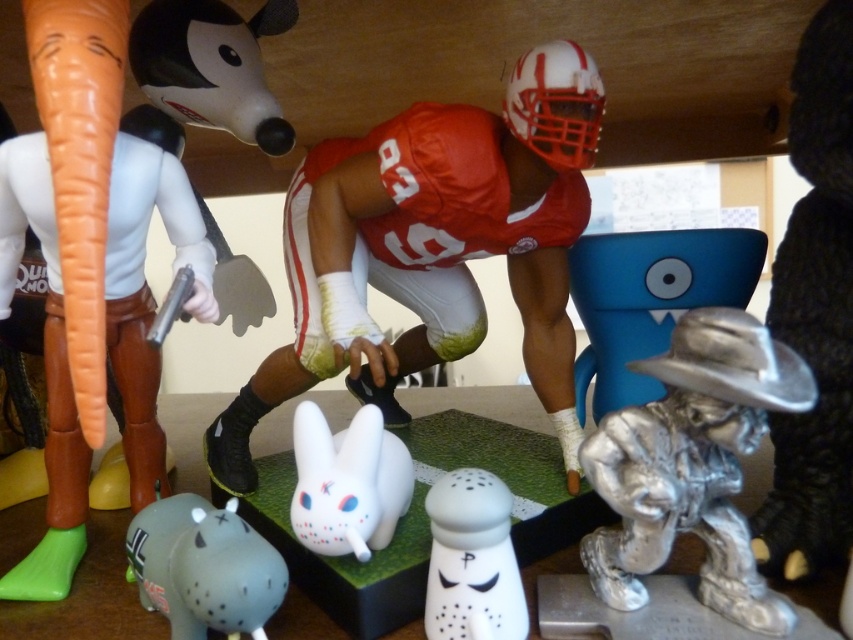
Is point (277, 403) in front of point (373, 538)?

No, (277, 403) is further to viewer.

The image size is (853, 640). In order to click on shiny plastic football player at center in this screenshot , I will do `click(438, 260)`.

Who is taller, silver metallic cowboy at lower right or red matte number at center?

silver metallic cowboy at lower right is taller.

The image size is (853, 640). Describe the element at coordinates (693, 465) in the screenshot. I see `silver metallic cowboy at lower right` at that location.

Identify the location of silver metallic cowboy at lower right. Image resolution: width=853 pixels, height=640 pixels. (693, 465).

Does smooth white rabbit at lower left have a lesser width compared to red matte number at center?

No.

You are a GUI agent. You are given a task and a screenshot of the screen. Output one action in this format:
    pyautogui.click(x=<x>, y=<y>)
    Task: Click on the smooth white rabbit at lower left
    This screenshot has height=640, width=853.
    Given the screenshot: What is the action you would take?
    pyautogui.click(x=181, y=195)